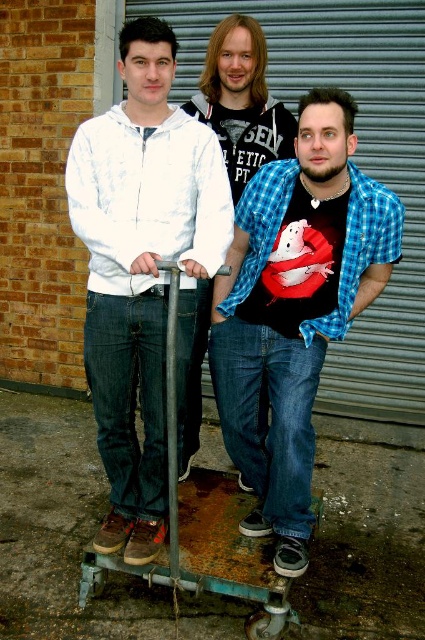
Between white cotton hoodie at center and matte black t-shirt at center, which one is positioned lower?

white cotton hoodie at center is below.

Does white cotton hoodie at center have a smaller size compared to matte black t-shirt at center?

Incorrect, white cotton hoodie at center is not smaller in size than matte black t-shirt at center.

Who is more forward, (76, 168) or (252, 54)?

Point (76, 168) is more forward.

Identify the location of white cotton hoodie at center. The image size is (425, 640). (141, 269).

Does point (124, 61) come in front of point (288, 38)?

Yes.

Is point (178, 394) farther from viewer compared to point (422, 122)?

No, it is in front of (422, 122).

Describe the element at coordinates (141, 269) in the screenshot. I see `white cotton hoodie at center` at that location.

Where is `white cotton hoodie at center`? Image resolution: width=425 pixels, height=640 pixels. white cotton hoodie at center is located at coordinates tap(141, 269).

Who is taller, metallic gray garage door at upper center or rusty metal skateboard at lower center?

With more height is metallic gray garage door at upper center.

Does metallic gray garage door at upper center have a greater height compared to rusty metal skateboard at lower center?

Yes.

Is point (328, 36) positioned after point (116, 568)?

That is True.

Where is `metallic gray garage door at upper center`? metallic gray garage door at upper center is located at coordinates (353, 157).